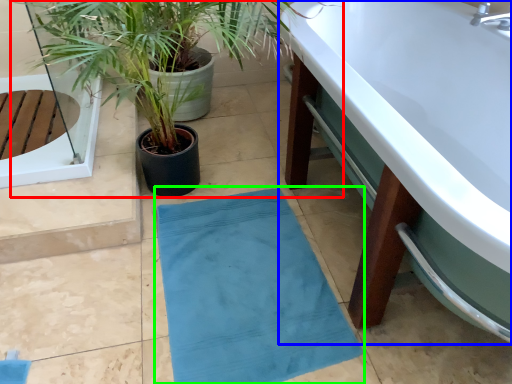
Question: Which object is positioned closest to houseplant (highlighted by a red box)? Select from bathtub (highlighted by a blue box) and bath mat (highlighted by a green box).

Choices:
 (A) bathtub
 (B) bath mat

Answer: (B)